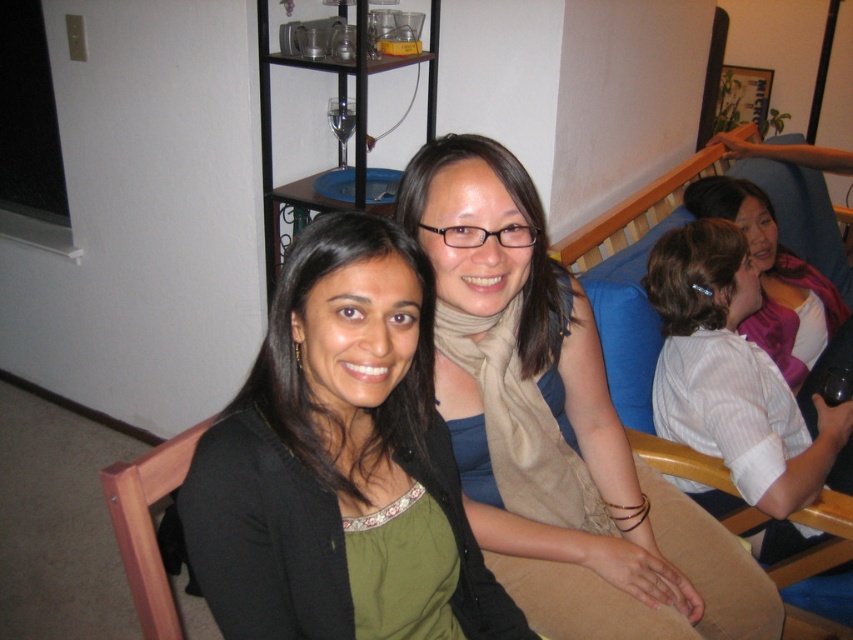
Question: Which of these objects is positioned farthest from the matte black sweater at center?

Choices:
 (A) pink fabric scarf at upper right
 (B) white striped shirt at right
 (C) beige scarf at center

Answer: (A)

Question: Observing the image, what is the correct spatial positioning of matte black sweater at center in reference to beige scarf at center?

Choices:
 (A) left
 (B) right

Answer: (A)

Question: Which object is farther from the camera taking this photo?

Choices:
 (A) pink fabric scarf at upper right
 (B) matte black sweater at center
 (C) beige scarf at center
 (D) white striped shirt at right

Answer: (A)

Question: Is beige scarf at center above white striped shirt at right?

Choices:
 (A) yes
 (B) no

Answer: (B)

Question: Observing the image, what is the correct spatial positioning of matte black sweater at center in reference to pink fabric scarf at upper right?

Choices:
 (A) right
 (B) left

Answer: (B)

Question: Which point appears farthest from the camera in this image?

Choices:
 (A) (788, 317)
 (B) (387, 333)
 (C) (746, 272)
 (D) (590, 474)

Answer: (A)